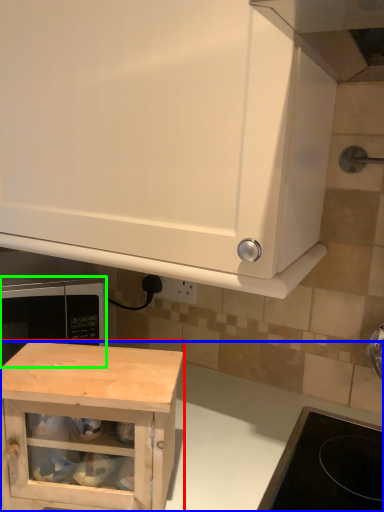
Question: Based on their relative distances, which object is farther from cabinetry (highlighted by a red box)? Choose from counter (highlighted by a blue box) and microwave oven (highlighted by a green box).

Choices:
 (A) counter
 (B) microwave oven

Answer: (B)